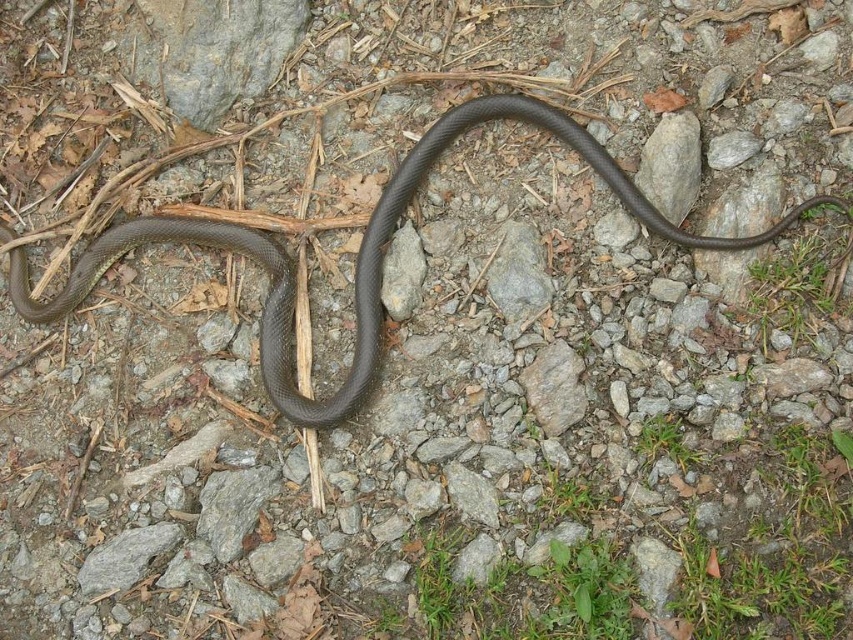
Question: Among these objects, which one is nearest to the camera?

Choices:
 (A) shiny black snake at center
 (B) gray rough rock at center

Answer: (A)

Question: Among these objects, which one is farthest from the camera?

Choices:
 (A) gray rough rock at center
 (B) shiny black snake at center

Answer: (A)

Question: In this image, where is shiny black snake at center located relative to gray rough rock at center?

Choices:
 (A) above
 (B) below

Answer: (A)

Question: Among these points, which one is farthest from the camera?

Choices:
 (A) (337, 396)
 (B) (548, 404)

Answer: (A)

Question: Is shiny black snake at center to the right of gray rough rock at center from the viewer's perspective?

Choices:
 (A) no
 (B) yes

Answer: (A)

Question: Can you confirm if shiny black snake at center is positioned above gray rough rock at center?

Choices:
 (A) yes
 (B) no

Answer: (A)